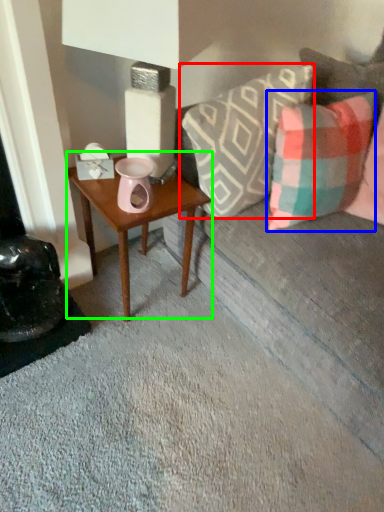
Question: Estimate the real-world distances between objects in this image. Which object is farther from pillow (highlighted by a red box), pillow (highlighted by a blue box) or table (highlighted by a green box)?

Choices:
 (A) pillow
 (B) table

Answer: (B)